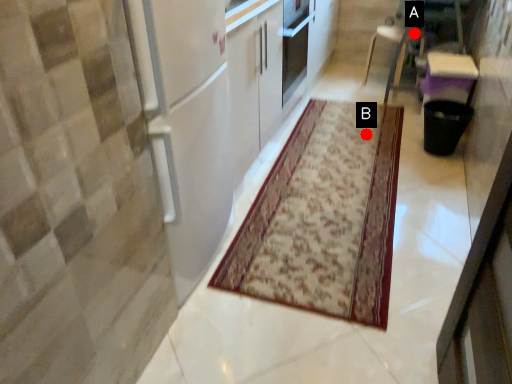
Question: Two points are circled on the image, labeled by A and B beside each circle. Which point appears closest to the camera in this image?

Choices:
 (A) A is closer
 (B) B is closer

Answer: (B)